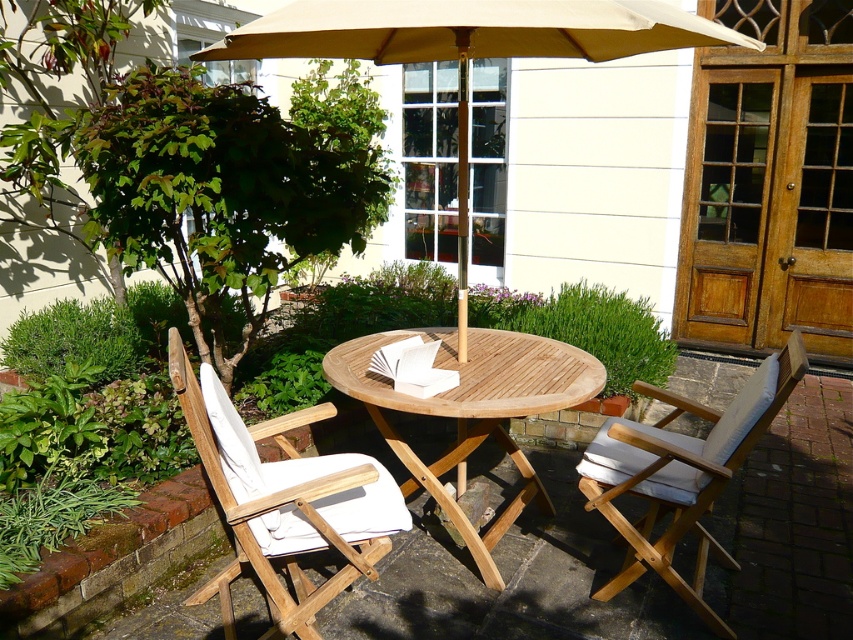
Question: Is teak wood chair at left positioned before teak wood table at center?

Choices:
 (A) yes
 (B) no

Answer: (A)

Question: Which object is the closest to the white wood chair at right?

Choices:
 (A) teak wood table at center
 (B) teak wood chair at left
 (C) beige fabric umbrella at center

Answer: (A)

Question: Does teak wood table at center appear over white wood chair at right?

Choices:
 (A) no
 (B) yes

Answer: (B)

Question: Which point is farther from the camera taking this photo?

Choices:
 (A) (363, 36)
 (B) (276, 419)
 (C) (428, 337)

Answer: (C)

Question: Which object is farther from the camera taking this photo?

Choices:
 (A) beige fabric umbrella at center
 (B) white wood chair at right
 (C) teak wood table at center

Answer: (C)

Question: Does beige fabric umbrella at center appear on the left side of teak wood table at center?

Choices:
 (A) yes
 (B) no

Answer: (B)